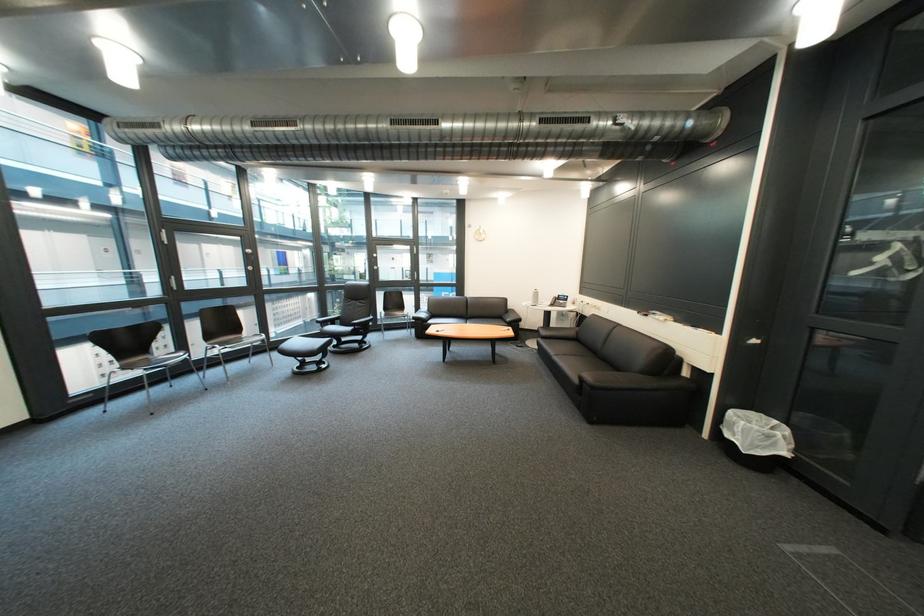
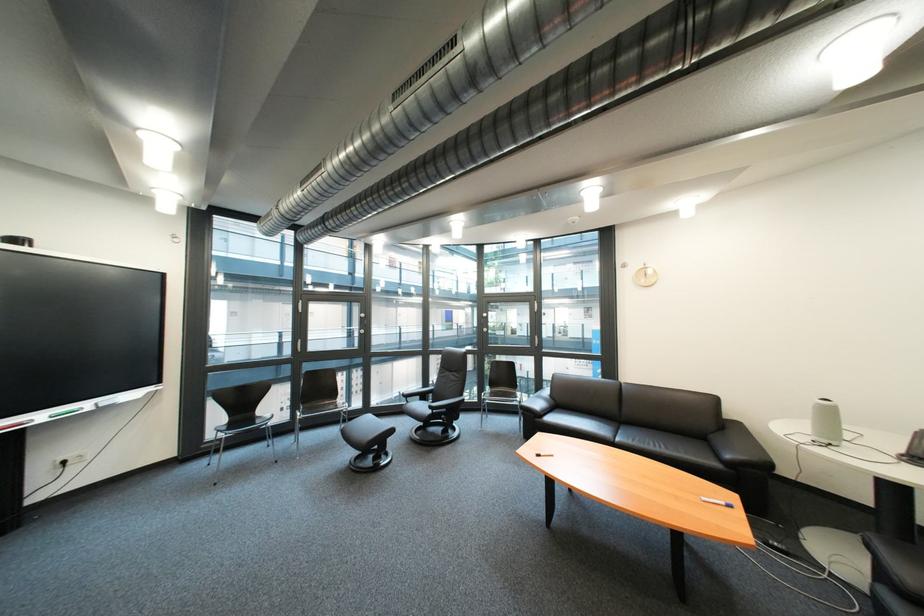
The point at (481, 323) is marked in the first image. Where is the corresponding point in the second image?

(634, 434)